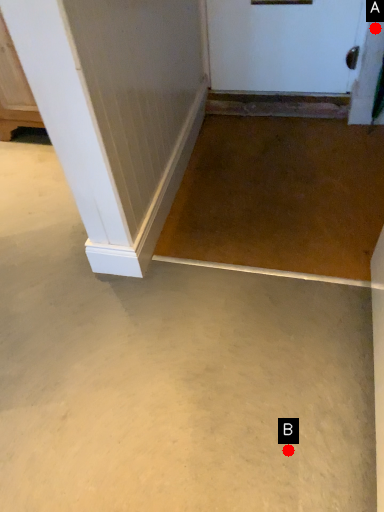
Question: Two points are circled on the image, labeled by A and B beside each circle. Which point appears farthest from the camera in this image?

Choices:
 (A) A is further
 (B) B is further

Answer: (A)